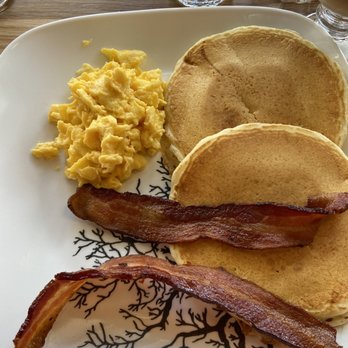
I want to click on plate, so click(x=1, y=174), click(x=30, y=220), click(x=22, y=95).